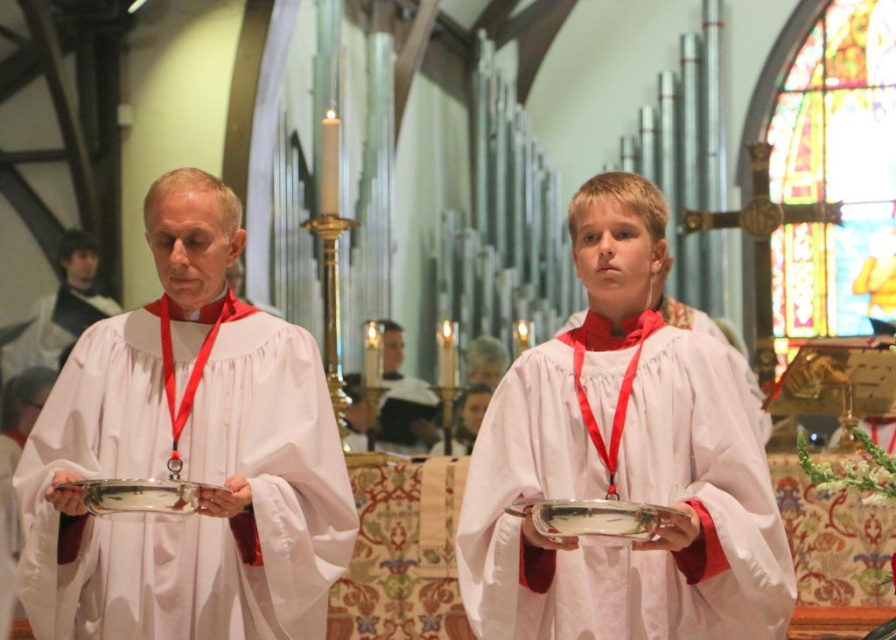
Locate an element on the screen. The image size is (896, 640). white cotton robe at left is located at coordinates (58, 310).

Which of these two, white cotton robe at left or silver metallic tray at center, stands taller?

silver metallic tray at center

Does point (40, 352) lie in front of point (90, 488)?

No.

Image resolution: width=896 pixels, height=640 pixels. What are the coordinates of `white cotton robe at left` in the screenshot? It's located at pos(58,310).

Does silver metallic platter at center have a smaller size compared to silver metallic tray at center?

No, silver metallic platter at center is not smaller than silver metallic tray at center.

Which of these two, silver metallic platter at center or silver metallic tray at center, stands taller?

With more height is silver metallic platter at center.

The height and width of the screenshot is (640, 896). I want to click on silver metallic platter at center, so click(x=600, y=518).

Who is more distant from viewer, (436,424) or (514,502)?

Positioned behind is point (436,424).

Which is above, smooth white robe at center or silver metallic platter at center?

smooth white robe at center

Is point (349, 438) behind point (668, 508)?

Yes, point (349, 438) is farther from viewer.

The height and width of the screenshot is (640, 896). I want to click on smooth white robe at center, so click(388, 397).